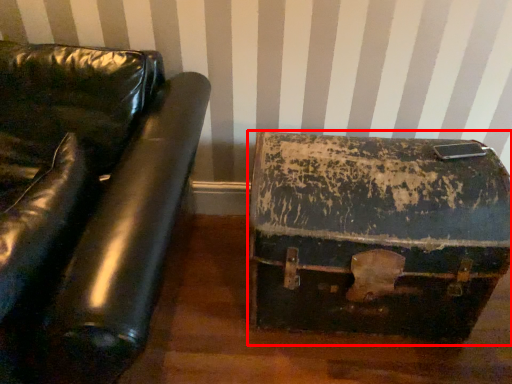
Question: From the image, what is the correct spatial relationship of suitcase (annotated by the red box) in relation to furniture?

Choices:
 (A) left
 (B) right

Answer: (B)